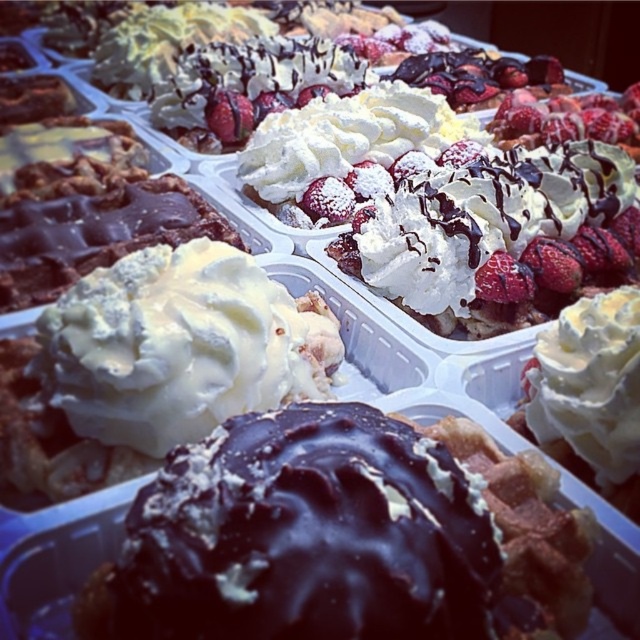
Who is more distant from viewer, (156, 515) or (280, 212)?

Point (280, 212)

Can you confirm if chocolate glazed donut at center is positioned above whipped cream topped waffle at center?

No.

Does point (113, 566) come closer to viewer compared to point (355, 168)?

That is True.

Identify the location of chocolate glazed donut at center. Image resolution: width=640 pixels, height=640 pixels. (301, 536).

Does whipped cream topped waffle with strawberries at center appear under white fluffy waffle at center?

No, whipped cream topped waffle with strawberries at center is not below white fluffy waffle at center.

Is whipped cream topped waffle with strawberries at center positioned before white fluffy waffle at center?

No, it is not.

Image resolution: width=640 pixels, height=640 pixels. Find the location of `whipped cream topped waffle with strawberries at center`. whipped cream topped waffle with strawberries at center is located at coordinates 499,236.

Who is shorter, whipped cream at center or white fluffy waffle at center?

whipped cream at center

From the picture: Between whipped cream at center and white fluffy waffle at center, which one is positioned higher?

white fluffy waffle at center is higher up.

Image resolution: width=640 pixels, height=640 pixels. I want to click on whipped cream at center, so click(x=179, y=346).

This screenshot has width=640, height=640. What are the coordinates of `whipped cream at center` in the screenshot? It's located at (179, 346).